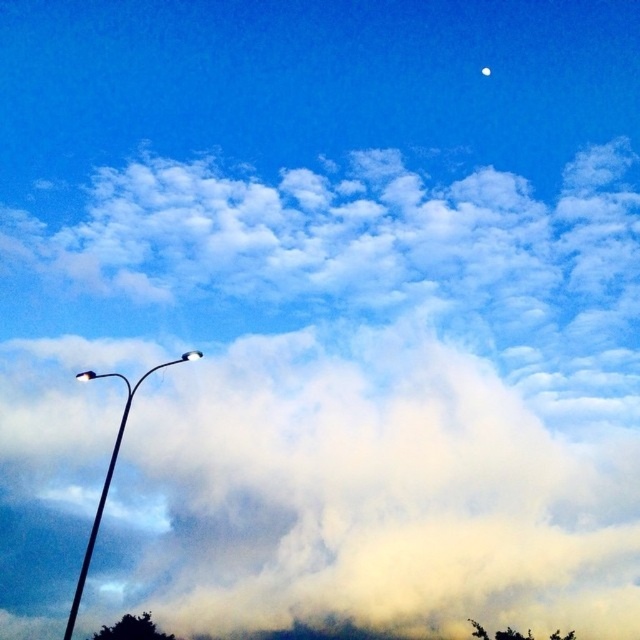
You are standing in the middle of the image and looking towards the metallic street light at left and the metallic pole at left. Which one appears taller to you?

The metallic street light at left is taller than the metallic pole at left, so the street light appears taller.